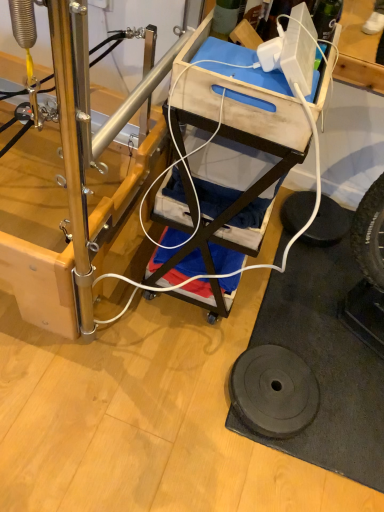
Question: Does black rubber weight at lower right have a smaller size compared to wooden cart at center?

Choices:
 (A) yes
 (B) no

Answer: (A)

Question: From a real-world perspective, is black rubber weight at lower right over wooden cart at center?

Choices:
 (A) no
 (B) yes

Answer: (A)

Question: From the image's perspective, would you say black rubber weight at lower right is positioned over wooden cart at center?

Choices:
 (A) no
 (B) yes

Answer: (A)

Question: Is black rubber weight at lower right taller than wooden cart at center?

Choices:
 (A) yes
 (B) no

Answer: (B)

Question: Considering the relative sizes of black rubber weight at lower right and wooden cart at center in the image provided, is black rubber weight at lower right thinner than wooden cart at center?

Choices:
 (A) yes
 (B) no

Answer: (A)

Question: Is wooden cart at center bigger or smaller than black rubber tire at lower right?

Choices:
 (A) small
 (B) big

Answer: (B)

Question: Considering the positions of wooden cart at center and black rubber tire at lower right in the image, is wooden cart at center taller or shorter than black rubber tire at lower right?

Choices:
 (A) tall
 (B) short

Answer: (A)

Question: Is wooden cart at center situated inside black rubber tire at lower right or outside?

Choices:
 (A) outside
 (B) inside

Answer: (A)

Question: Considering the positions of wooden cart at center and black rubber tire at lower right in the image, is wooden cart at center wider or thinner than black rubber tire at lower right?

Choices:
 (A) wide
 (B) thin

Answer: (A)

Question: From the image's perspective, is wooden cart at center above or below black rubber weight at lower right?

Choices:
 (A) below
 (B) above

Answer: (B)

Question: Is wooden cart at center taller or shorter than black rubber weight at lower right?

Choices:
 (A) short
 (B) tall

Answer: (B)

Question: Looking at their shapes, would you say wooden cart at center is wider or thinner than black rubber weight at lower right?

Choices:
 (A) wide
 (B) thin

Answer: (A)

Question: Visually, is wooden cart at center positioned to the left or to the right of black rubber weight at lower right?

Choices:
 (A) left
 (B) right

Answer: (A)

Question: From the image's perspective, is black rubber tire at lower right located above or below black rubber weight at lower right?

Choices:
 (A) above
 (B) below

Answer: (A)

Question: Would you say black rubber tire at lower right is to the left or to the right of black rubber weight at lower right in the picture?

Choices:
 (A) right
 (B) left

Answer: (A)